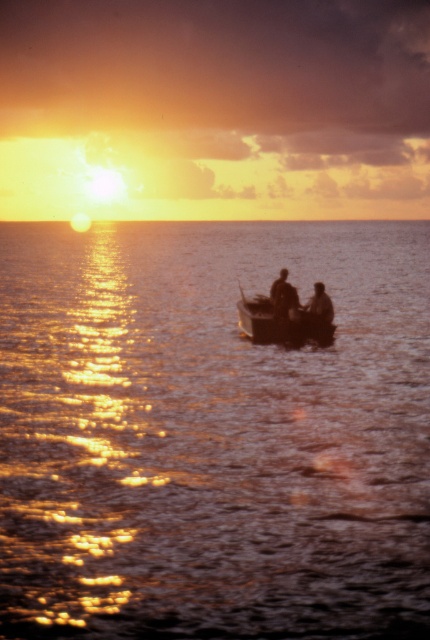
You are an observer watching the sunset scene. You notice the glistening water at center and the smooth wooden boat at center. Which object takes up more space in the image?

The glistening water at center is larger in size than the smooth wooden boat at center, so it takes up more space in the image.

Consider the image. You are a photographer trying to capture the sunset scene. You notice the silhouette wooden boat at center and the smooth skin face at center in your frame. Based on their sizes, which object should you focus on to ensure it fills the frame better?

The silhouette wooden boat at center has a larger size compared to the smooth skin face at center, so focusing on the silhouette wooden boat at center will fill the frame better.

You are standing on the shore and see the glistening water at center and the smooth wooden boat at center. Which object is located to the left of the other?

The glistening water at center is positioned on the left side of smooth wooden boat at center.